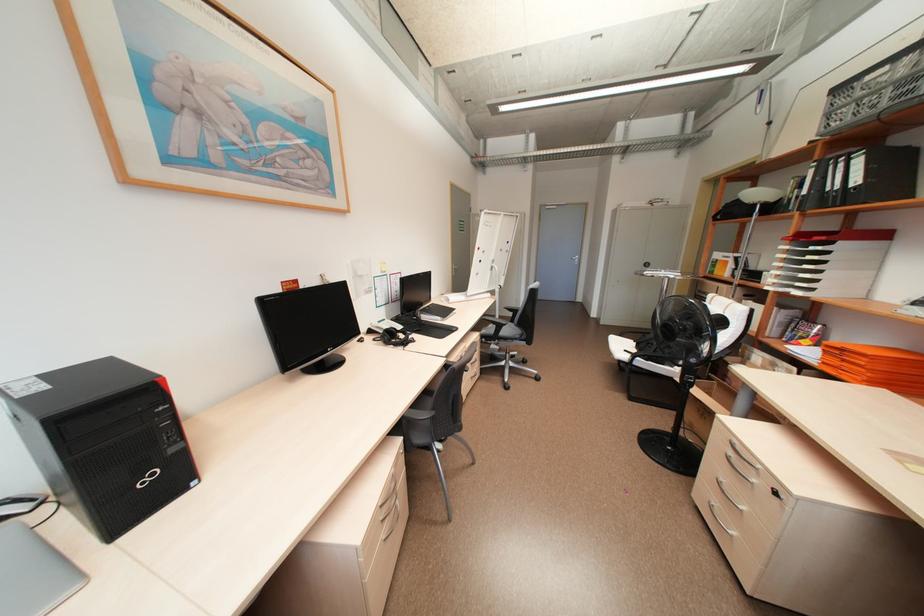
What are the coordinates of `metal door handle` in the screenshot? It's located at [x=575, y=259].